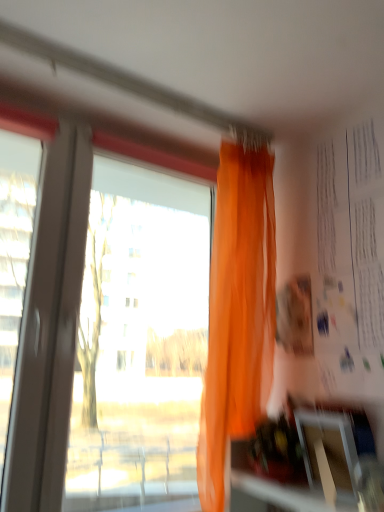
Question: From a real-world perspective, is orange sheer curtain at upper center located higher than white paper at upper right?

Choices:
 (A) no
 (B) yes

Answer: (A)

Question: From the image's perspective, does orange sheer curtain at upper center appear higher than white paper at upper right?

Choices:
 (A) no
 (B) yes

Answer: (A)

Question: From the image's perspective, would you say orange sheer curtain at upper center is shown under white paper at upper right?

Choices:
 (A) yes
 (B) no

Answer: (A)

Question: Is orange sheer curtain at upper center positioned with its back to white paper at upper right?

Choices:
 (A) no
 (B) yes

Answer: (A)

Question: Is orange sheer curtain at upper center positioned behind white paper at upper right?

Choices:
 (A) yes
 (B) no

Answer: (A)

Question: Considering the positions of orange sheer curtain at upper center and transparent plastic window screen at lower right in the image, is orange sheer curtain at upper center wider or thinner than transparent plastic window screen at lower right?

Choices:
 (A) wide
 (B) thin

Answer: (A)

Question: From a real-world perspective, is orange sheer curtain at upper center above or below transparent plastic window screen at lower right?

Choices:
 (A) below
 (B) above

Answer: (B)

Question: Considering the relative positions of orange sheer curtain at upper center and transparent plastic window screen at lower right in the image provided, is orange sheer curtain at upper center to the left or to the right of transparent plastic window screen at lower right?

Choices:
 (A) left
 (B) right

Answer: (A)

Question: Relative to transparent plastic window screen at lower right, is orange sheer curtain at upper center in front or behind?

Choices:
 (A) behind
 (B) front

Answer: (A)

Question: Would you say white paper at upper right is inside or outside orange sheer curtain at upper center?

Choices:
 (A) outside
 (B) inside

Answer: (A)

Question: Considering the positions of point (339, 377) and point (196, 460), is point (339, 377) closer or farther from the camera than point (196, 460)?

Choices:
 (A) farther
 (B) closer

Answer: (B)

Question: From a real-world perspective, relative to orange sheer curtain at upper center, is white paper at upper right vertically above or below?

Choices:
 (A) below
 (B) above

Answer: (B)

Question: Looking at their shapes, would you say white paper at upper right is wider or thinner than orange sheer curtain at upper center?

Choices:
 (A) wide
 (B) thin

Answer: (B)

Question: Is transparent plastic window screen at lower right in front of or behind white paper at upper right in the image?

Choices:
 (A) front
 (B) behind

Answer: (A)

Question: From the image's perspective, is transparent plastic window screen at lower right above or below white paper at upper right?

Choices:
 (A) below
 (B) above

Answer: (A)